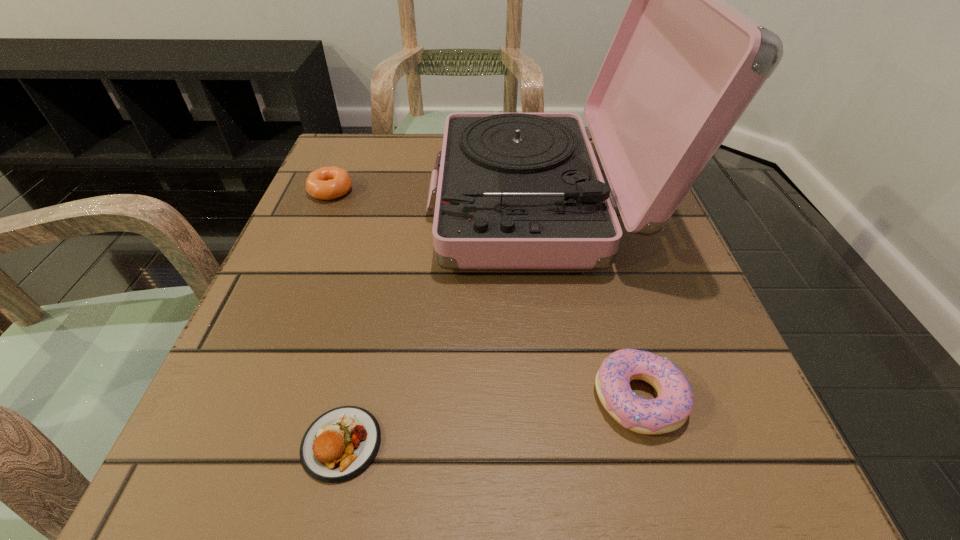
The width and height of the screenshot is (960, 540). In order to click on free space between the right doughnut and the third object from right to left in this screenshot , I will do `click(491, 421)`.

You are a GUI agent. You are given a task and a screenshot of the screen. Output one action in this format:
    pyautogui.click(x=<x>, y=<y>)
    Task: Click on the free space between the shortest object and the leftmost object
    
    Given the screenshot: What is the action you would take?
    pyautogui.click(x=336, y=317)

Locate an element on the screen. empty location between the farther doughnut and the nearer doughnut is located at coordinates (485, 294).

Find the location of a particular element. empty space between the shortest object and the record player is located at coordinates (442, 323).

Where is `vacant space that's between the nearer doughnut and the farther doughnut`? This screenshot has width=960, height=540. vacant space that's between the nearer doughnut and the farther doughnut is located at coordinates (485, 294).

You are a GUI agent. You are given a task and a screenshot of the screen. Output one action in this format:
    pyautogui.click(x=<x>, y=<y>)
    Task: Click on the free space between the farther doughnut and the right doughnut
    The image size is (960, 540).
    Given the screenshot: What is the action you would take?
    pyautogui.click(x=485, y=294)

In order to click on free area in between the shortest object and the record player in this screenshot , I will do `click(442, 323)`.

The height and width of the screenshot is (540, 960). I want to click on empty space that is in between the right doughnut and the left doughnut, so click(x=485, y=294).

Find the location of a particular element. The height and width of the screenshot is (540, 960). the third closest object relative to the right doughnut is located at coordinates (327, 183).

Where is `object that is the second closest to the leftmost object`? object that is the second closest to the leftmost object is located at coordinates (340, 444).